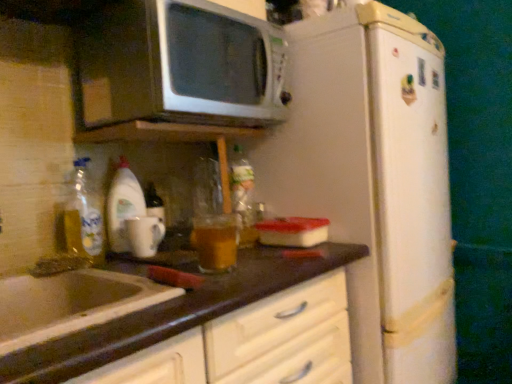
Question: Is white glossy microwave at upper center outside white matte refrigerator at center-right?

Choices:
 (A) no
 (B) yes

Answer: (B)

Question: From a real-world perspective, is white glossy microwave at upper center under white matte refrigerator at center-right?

Choices:
 (A) no
 (B) yes

Answer: (A)

Question: Does white glossy microwave at upper center lie in front of white matte refrigerator at center-right?

Choices:
 (A) no
 (B) yes

Answer: (B)

Question: Is white glossy microwave at upper center in contact with white matte refrigerator at center-right?

Choices:
 (A) no
 (B) yes

Answer: (A)

Question: From a real-world perspective, is white glossy microwave at upper center physically above white matte refrigerator at center-right?

Choices:
 (A) yes
 (B) no

Answer: (A)

Question: Can you confirm if white glossy microwave at upper center is bigger than white matte refrigerator at center-right?

Choices:
 (A) yes
 (B) no

Answer: (B)

Question: Can you confirm if translucent glass mug at left is taller than white glossy sink at lower left?

Choices:
 (A) yes
 (B) no

Answer: (A)

Question: Are translucent glass mug at left and white glossy sink at lower left beside each other?

Choices:
 (A) no
 (B) yes

Answer: (A)

Question: From the image's perspective, is translucent glass mug at left under white glossy sink at lower left?

Choices:
 (A) no
 (B) yes

Answer: (A)

Question: Is translucent glass mug at left wider than white glossy sink at lower left?

Choices:
 (A) yes
 (B) no

Answer: (B)

Question: From a real-world perspective, is translucent glass mug at left over white glossy sink at lower left?

Choices:
 (A) no
 (B) yes

Answer: (B)

Question: Is translucent glass mug at left not within white glossy sink at lower left?

Choices:
 (A) yes
 (B) no

Answer: (A)

Question: From the image's perspective, does translucent plastic bottle at center appear higher than white matte refrigerator at center-right?

Choices:
 (A) yes
 (B) no

Answer: (A)